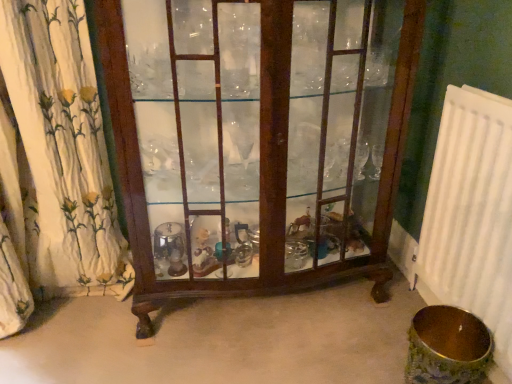
I want to click on vacant space in mahogany glass cabinet at center (from a real-world perspective), so click(x=238, y=311).